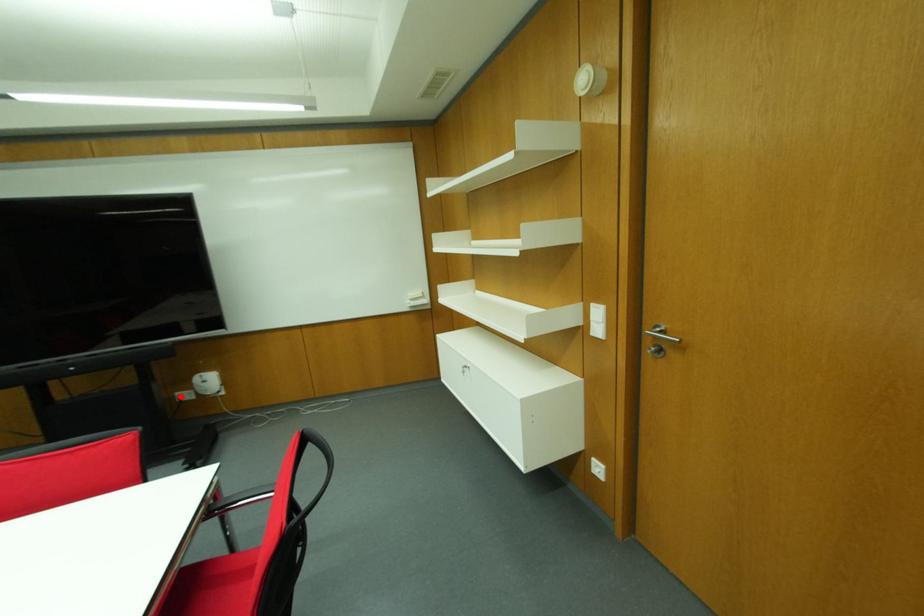
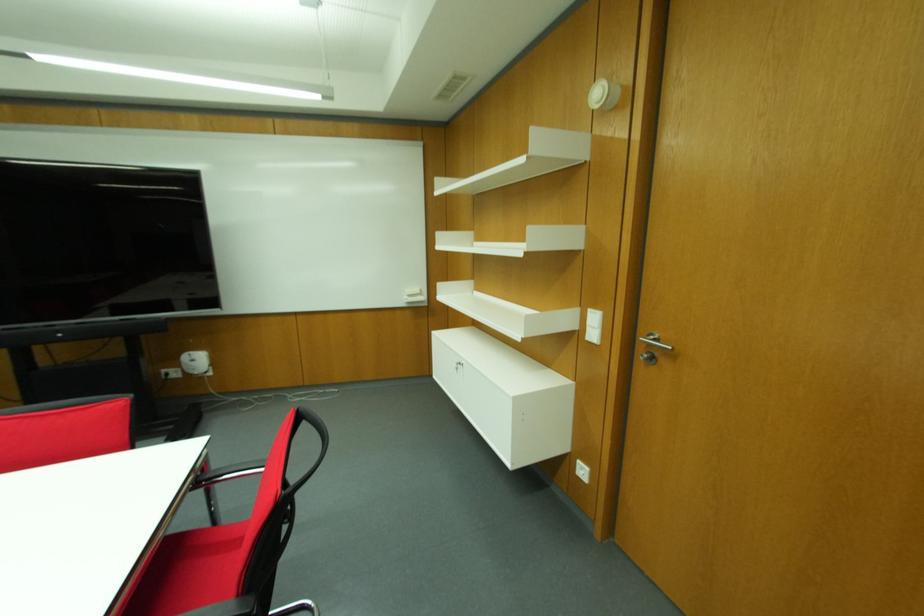
The point at the highlighted location is marked in the first image. Where is the corresponding point in the second image?

(166, 374)